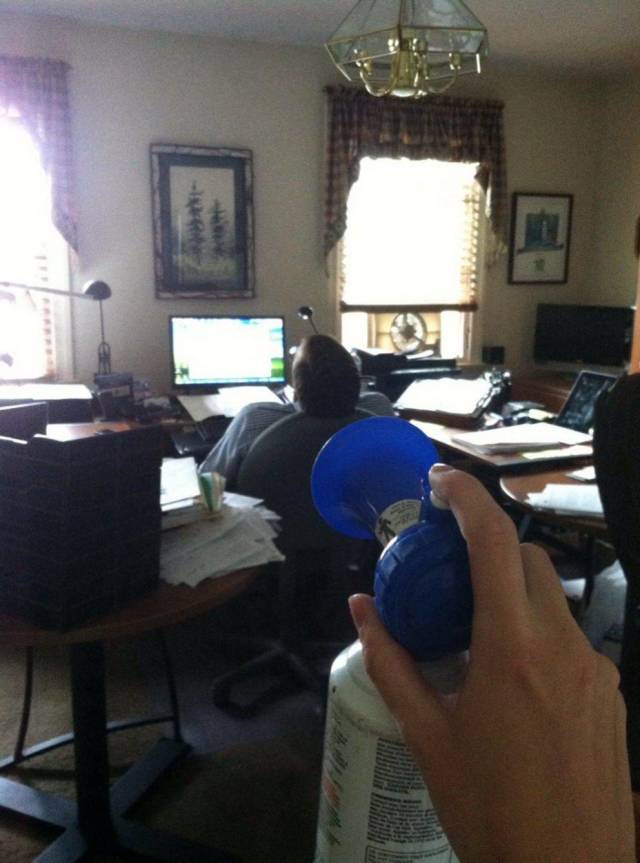
Identify the location of computer monitor turned on. This screenshot has width=640, height=863. (226, 348).